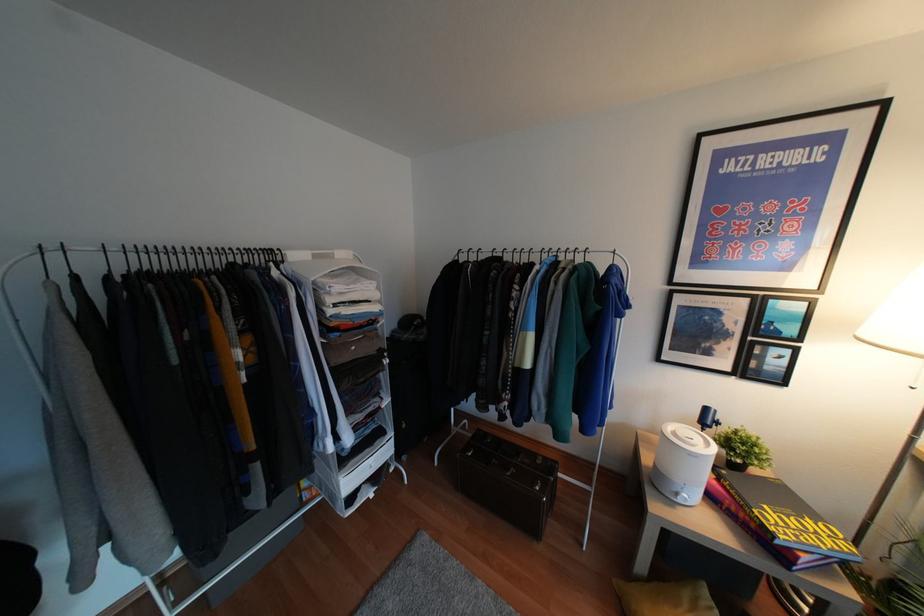
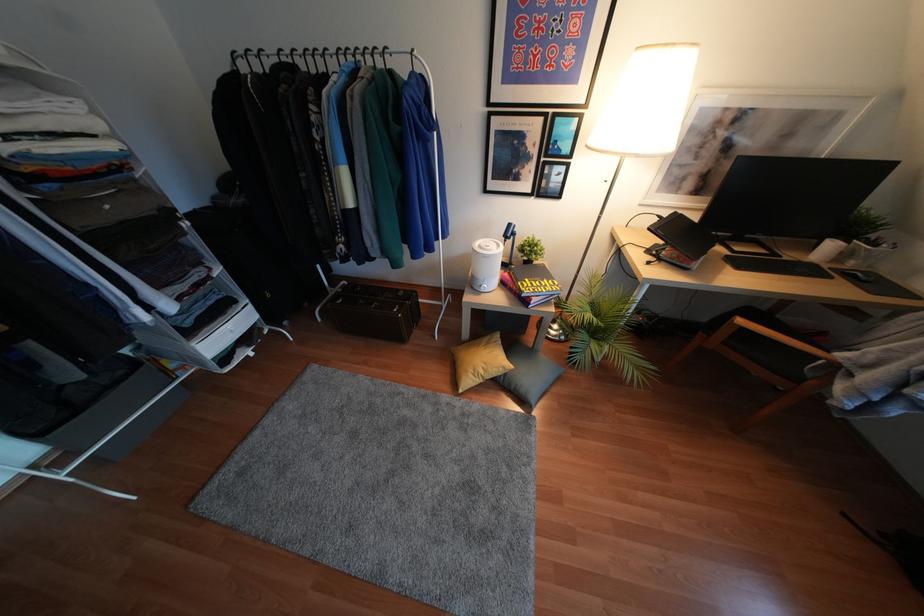
Where in the second image is the point corresponding to [751,432] from the first image?

(536, 237)